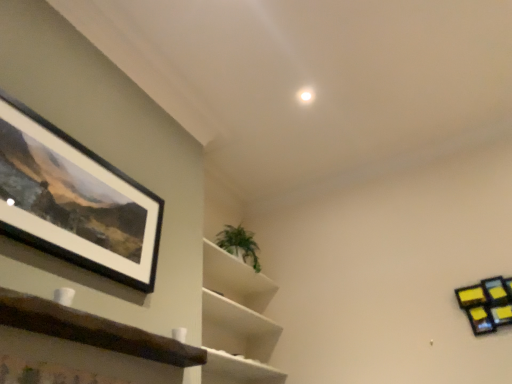
Question: Is green leafy plant at upper center next to yellow sticky notes at upper right, which is the 3th shelf in front-to-back order, and touching it?

Choices:
 (A) yes
 (B) no

Answer: (B)

Question: Is yellow sticky notes at upper right, which is the 3th shelf in front-to-back order, completely or partially inside green leafy plant at upper center?

Choices:
 (A) yes
 (B) no

Answer: (B)

Question: Would you consider green leafy plant at upper center to be distant from yellow sticky notes at upper right, the first shelf from the right?

Choices:
 (A) no
 (B) yes

Answer: (B)

Question: From a real-world perspective, is green leafy plant at upper center located higher than yellow sticky notes at upper right, the third shelf viewed from the left?

Choices:
 (A) yes
 (B) no

Answer: (A)

Question: Is green leafy plant at upper center thinner than yellow sticky notes at upper right, which is counted as the 1th shelf, starting from the back?

Choices:
 (A) yes
 (B) no

Answer: (B)

Question: From a real-world perspective, is green leafy plant at center, marked as the second shelf in a right-to-left arrangement, positioned above or below black matte picture frame at upper left?

Choices:
 (A) below
 (B) above

Answer: (A)

Question: From the image's perspective, is green leafy plant at center, which ranks as the 2th shelf in back-to-front order, above or below black matte picture frame at upper left?

Choices:
 (A) above
 (B) below

Answer: (B)

Question: Is green leafy plant at center, positioned as the 2th shelf in front-to-back order, bigger or smaller than black matte picture frame at upper left?

Choices:
 (A) small
 (B) big

Answer: (B)

Question: Choose the correct answer: Is green leafy plant at center, the second shelf positioned from the left, inside black matte picture frame at upper left or outside it?

Choices:
 (A) inside
 (B) outside

Answer: (B)

Question: Based on their sizes in the image, would you say yellow sticky notes at upper right, the first shelf from the right, is bigger or smaller than brown wooden shelf at lower left, the third shelf in the right-to-left sequence?

Choices:
 (A) big
 (B) small

Answer: (B)

Question: Is yellow sticky notes at upper right, which is counted as the 1th shelf, starting from the back, inside the boundaries of brown wooden shelf at lower left, the first shelf viewed from the left, or outside?

Choices:
 (A) inside
 (B) outside

Answer: (B)

Question: From the image's perspective, is yellow sticky notes at upper right, which is the 3th shelf in front-to-back order, located above or below brown wooden shelf at lower left, the third shelf in the right-to-left sequence?

Choices:
 (A) above
 (B) below

Answer: (B)

Question: From a real-world perspective, is yellow sticky notes at upper right, which is the 3th shelf in front-to-back order, positioned above or below brown wooden shelf at lower left, the third shelf in the right-to-left sequence?

Choices:
 (A) below
 (B) above

Answer: (B)

Question: Looking at the image, does black matte picture frame at upper left seem bigger or smaller compared to yellow sticky notes at upper right, which is the 3th shelf in front-to-back order?

Choices:
 (A) big
 (B) small

Answer: (A)

Question: Visually, is black matte picture frame at upper left positioned to the left or to the right of yellow sticky notes at upper right, which is counted as the 1th shelf, starting from the back?

Choices:
 (A) left
 (B) right

Answer: (A)